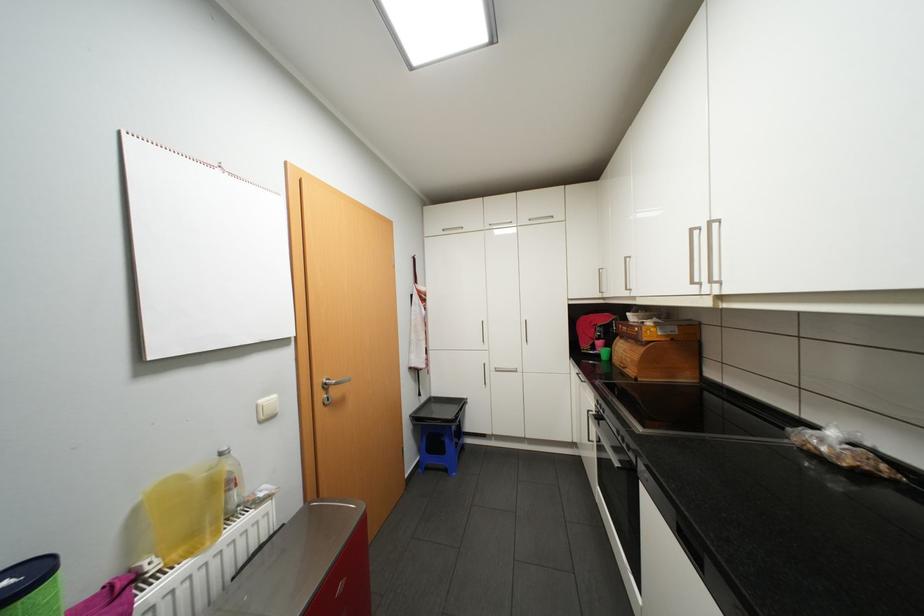
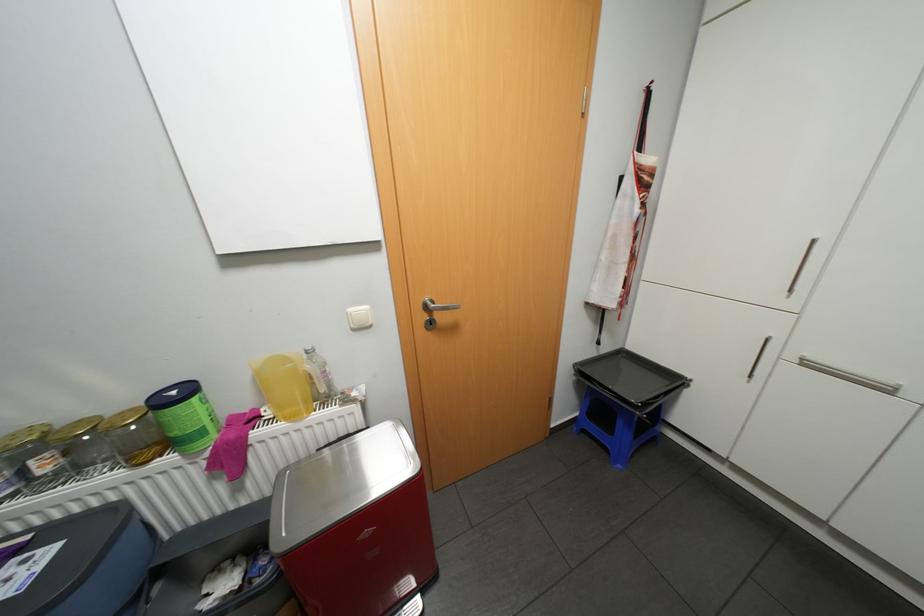
The point at (505, 370) is marked in the first image. Where is the corresponding point in the second image?

(813, 363)